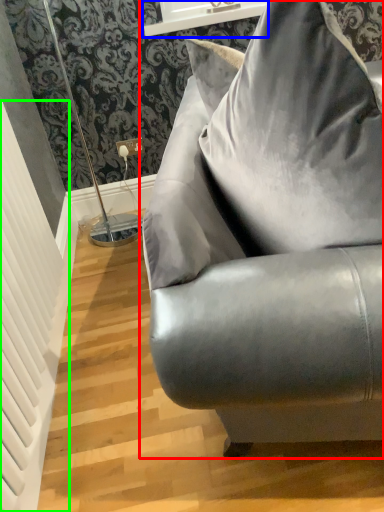
Question: Which object is the farthest from studio couch (highlighted by a red box)? Choose among these: window sill (highlighted by a blue box) or radiator (highlighted by a green box).

Choices:
 (A) window sill
 (B) radiator

Answer: (A)